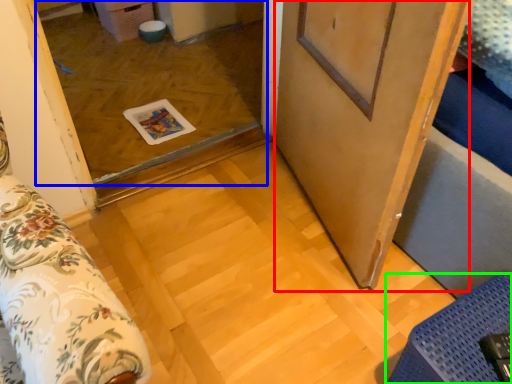
Question: Which object is the farthest from barn door (highlighted by a red box)? Choose among these: window (highlighted by a blue box) or furniture (highlighted by a green box).

Choices:
 (A) window
 (B) furniture

Answer: (A)